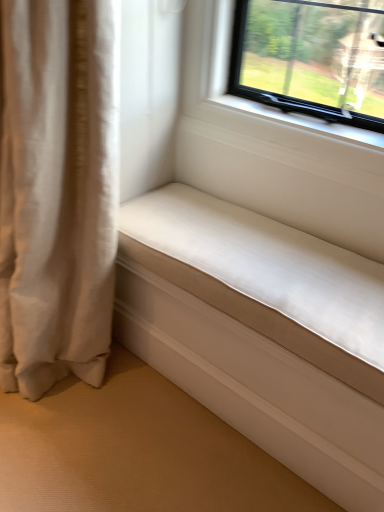
Question: Considering the positions of beige fabric curtain at left and white smooth cushion at lower right in the image, is beige fabric curtain at left bigger or smaller than white smooth cushion at lower right?

Choices:
 (A) big
 (B) small

Answer: (A)

Question: Would you say beige fabric curtain at left is to the left or to the right of white smooth cushion at lower right in the picture?

Choices:
 (A) left
 (B) right

Answer: (A)

Question: Is beige fabric curtain at left situated inside white smooth cushion at lower right or outside?

Choices:
 (A) inside
 (B) outside

Answer: (B)

Question: From a real-world perspective, is white smooth cushion at lower right positioned above or below beige fabric curtain at left?

Choices:
 (A) below
 (B) above

Answer: (A)

Question: Would you say white smooth cushion at lower right is to the left or to the right of beige fabric curtain at left in the picture?

Choices:
 (A) left
 (B) right

Answer: (B)

Question: Is white smooth cushion at lower right wider or thinner than beige fabric curtain at left?

Choices:
 (A) thin
 (B) wide

Answer: (A)

Question: From the image's perspective, is white smooth cushion at lower right located above or below beige fabric curtain at left?

Choices:
 (A) above
 (B) below

Answer: (B)